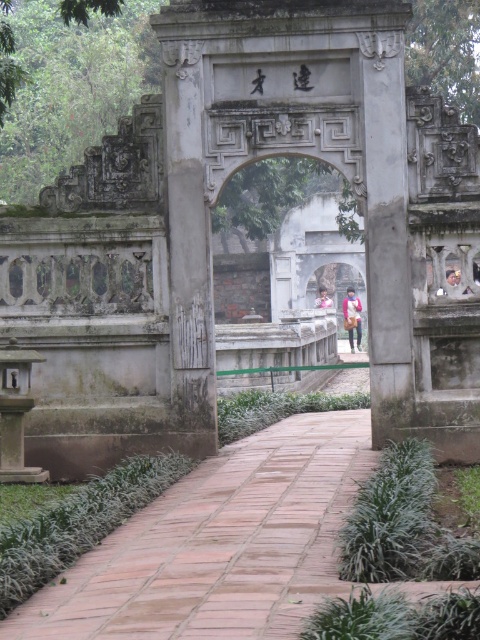
Question: Which object is the farthest from the pink fabric at center?

Choices:
 (A) smooth stone lantern at left
 (B) matte brown jacket at center

Answer: (A)

Question: Can you confirm if smooth stone lantern at left is wider than pink fabric at center?

Choices:
 (A) no
 (B) yes

Answer: (B)

Question: Which point appears farthest from the camera in this image?

Choices:
 (A) (352, 333)
 (B) (43, 360)
 (C) (141, 534)

Answer: (A)

Question: Can you confirm if brown brick path at center is wider than matte brown jacket at center?

Choices:
 (A) no
 (B) yes

Answer: (B)

Question: Which is farther from the pink fabric at center?

Choices:
 (A) brown brick path at center
 (B) smooth stone lantern at left

Answer: (A)

Question: Does brown brick path at center have a smaller size compared to matte brown jacket at center?

Choices:
 (A) yes
 (B) no

Answer: (B)